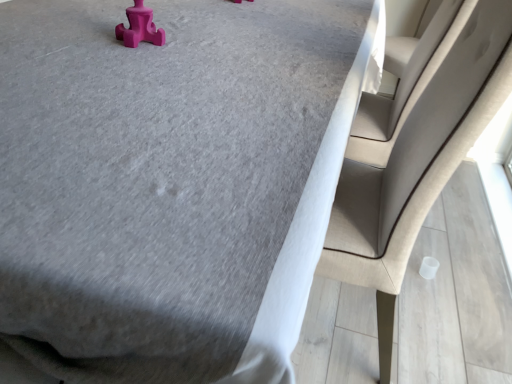
I want to click on pink rubber toy at upper left, so click(x=139, y=27).

Image resolution: width=512 pixels, height=384 pixels. What do you see at coordinates (139, 27) in the screenshot? I see `pink rubber toy at upper left` at bounding box center [139, 27].

In the scene shown: What is the approximate width of beige fabric chair at right?

beige fabric chair at right is 20.22 inches wide.

You are a GUI agent. You are given a task and a screenshot of the screen. Output one action in this format:
    pyautogui.click(x=<x>, y=<y>)
    Task: Click on the beige fabric chair at right
    The image size is (512, 384).
    Given the screenshot: What is the action you would take?
    pyautogui.click(x=415, y=148)

This screenshot has height=384, width=512. Describe the element at coordinates (415, 148) in the screenshot. I see `beige fabric chair at right` at that location.

Measure the distance between beige fabric chair at right and camera.

The distance of beige fabric chair at right from camera is 26.88 inches.

You are a GUI agent. You are given a task and a screenshot of the screen. Output one action in this format:
    pyautogui.click(x=<x>, y=<y>)
    Task: Click on the pink rubber toy at upper left
    Image resolution: width=512 pixels, height=384 pixels.
    Given the screenshot: What is the action you would take?
    pyautogui.click(x=139, y=27)

Consider the image. Is beige fabric chair at right to the left or to the right of pink rubber toy at upper left in the image?

From the image, it's evident that beige fabric chair at right is to the right of pink rubber toy at upper left.

Which object is closer to the camera, beige fabric chair at right or pink rubber toy at upper left?

beige fabric chair at right.

Which point is more forward, (480, 59) or (144, 11)?

The point (480, 59) is closer.

Looking at this image, from the image's perspective, is beige fabric chair at right located above or below pink rubber toy at upper left?

Based on their image positions, beige fabric chair at right is located beneath pink rubber toy at upper left.

From a real-world perspective, does beige fabric chair at right stand above pink rubber toy at upper left?

No, from a real-world perspective, beige fabric chair at right is not above pink rubber toy at upper left.

Is beige fabric chair at right thinner than pink rubber toy at upper left?

Incorrect, the width of beige fabric chair at right is not less than that of pink rubber toy at upper left.

Does beige fabric chair at right have a lesser height compared to pink rubber toy at upper left?

In fact, beige fabric chair at right may be taller than pink rubber toy at upper left.

Looking at the image, does beige fabric chair at right seem bigger or smaller compared to pink rubber toy at upper left?

Clearly, beige fabric chair at right is larger in size than pink rubber toy at upper left.

Would you say beige fabric chair at right is inside or outside pink rubber toy at upper left?

beige fabric chair at right is not inside pink rubber toy at upper left, it's outside.

Is the surface of beige fabric chair at right in direct contact with pink rubber toy at upper left?

No.

Could you tell me if beige fabric chair at right is facing pink rubber toy at upper left?

Yes, beige fabric chair at right faces towards pink rubber toy at upper left.

Can you tell me how much beige fabric chair at right and pink rubber toy at upper left differ in facing direction?

There is a 2.28-degree angle between the facing directions of beige fabric chair at right and pink rubber toy at upper left.

Locate an element on the screen. This screenshot has width=512, height=384. toy behind the beige fabric chair at right is located at coordinates (139, 27).

From the picture: Between pink rubber toy at upper left and beige fabric chair at right, which one appears on the right side from the viewer's perspective?

beige fabric chair at right is more to the right.

Considering the relative positions of pink rubber toy at upper left and beige fabric chair at right in the image provided, is pink rubber toy at upper left behind beige fabric chair at right?

Yes.

Which is closer, (154, 24) or (451, 28)?

Point (154, 24)

From the image's perspective, is pink rubber toy at upper left positioned above or below beige fabric chair at right?

Clearly, from the image's perspective, pink rubber toy at upper left is above beige fabric chair at right.

From a real-world perspective, is pink rubber toy at upper left beneath beige fabric chair at right?

No, from a real-world perspective, pink rubber toy at upper left is not under beige fabric chair at right.

Can you confirm if pink rubber toy at upper left is wider than beige fabric chair at right?

No, pink rubber toy at upper left is not wider than beige fabric chair at right.

Is pink rubber toy at upper left shorter than beige fabric chair at right?

Correct, pink rubber toy at upper left is not as tall as beige fabric chair at right.

In terms of size, does pink rubber toy at upper left appear bigger or smaller than beige fabric chair at right?

pink rubber toy at upper left is smaller than beige fabric chair at right.

Is pink rubber toy at upper left completely or partially outside of beige fabric chair at right?

Yes, pink rubber toy at upper left is located beyond the bounds of beige fabric chair at right.

Is pink rubber toy at upper left far away from beige fabric chair at right?

pink rubber toy at upper left is near beige fabric chair at right, not far away.

Is beige fabric chair at right at the back of pink rubber toy at upper left?

Yes, beige fabric chair at right is at the back of pink rubber toy at upper left.

What's the angular difference between pink rubber toy at upper left and beige fabric chair at right's facing directions?

The angular difference between pink rubber toy at upper left and beige fabric chair at right is 2.28 degrees.

At what (x,y) coordinates should I click in order to perform the action: click on toy behind the beige fabric chair at right. Please return your answer as a coordinate pair (x, y). The height and width of the screenshot is (384, 512). Looking at the image, I should click on (139, 27).

Find the location of `chair below the pink rubber toy at upper left (from a real-world perspective)`. chair below the pink rubber toy at upper left (from a real-world perspective) is located at coordinates (415, 148).

At what (x,y) coordinates should I click in order to perform the action: click on toy above the beige fabric chair at right (from the image's perspective). Please return your answer as a coordinate pair (x, y). The image size is (512, 384). Looking at the image, I should click on (139, 27).